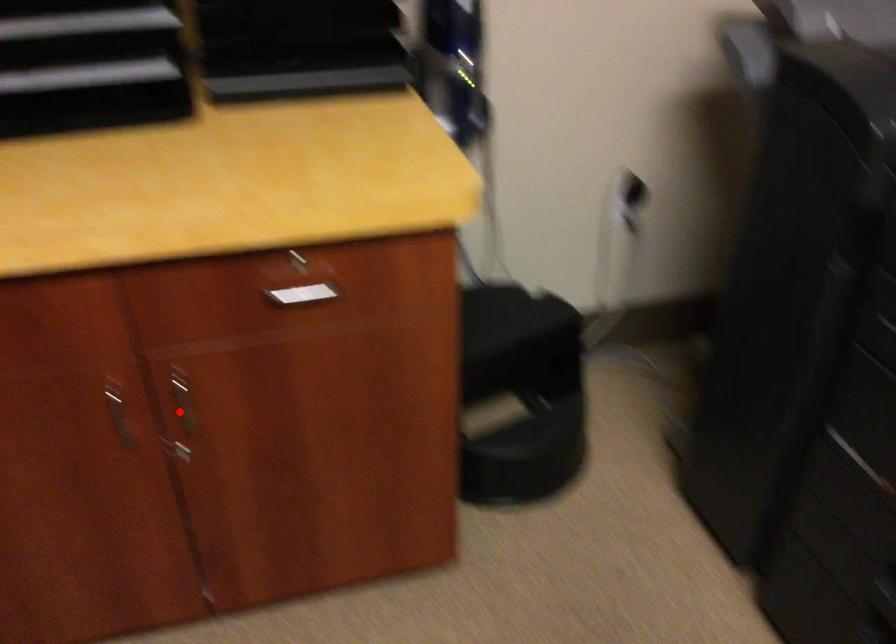
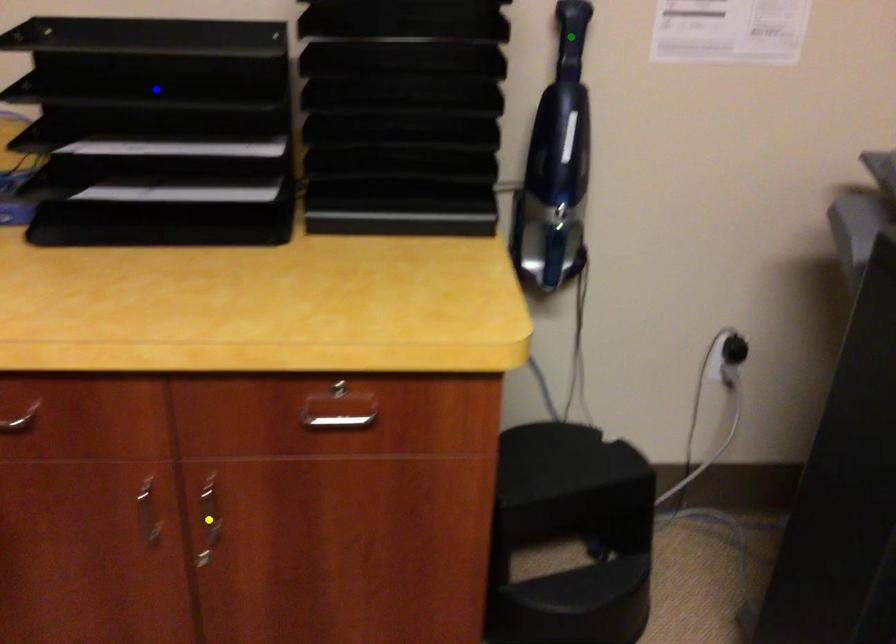
Question: I am providing you with two images of the same scene from different viewpoints. A red point is marked on the first image. You are given multiple points on the second image. Which mark in image 2 goes with the point in image 1?

Choices:
 (A) green point
 (B) yellow point
 (C) blue point

Answer: (B)